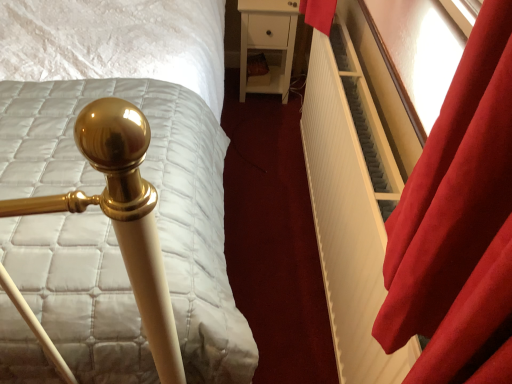
Question: From a real-world perspective, is white matte nightstand at center under velvet red curtain at right?

Choices:
 (A) no
 (B) yes

Answer: (B)

Question: Are white matte nightstand at center and velvet red curtain at right beside each other?

Choices:
 (A) yes
 (B) no

Answer: (B)

Question: Is white matte nightstand at center oriented towards velvet red curtain at right?

Choices:
 (A) no
 (B) yes

Answer: (B)

Question: Does white matte nightstand at center have a lesser height compared to velvet red curtain at right?

Choices:
 (A) no
 (B) yes

Answer: (A)

Question: From the image's perspective, is white matte nightstand at center located beneath velvet red curtain at right?

Choices:
 (A) yes
 (B) no

Answer: (B)

Question: Can you confirm if white matte nightstand at center is thinner than velvet red curtain at right?

Choices:
 (A) no
 (B) yes

Answer: (A)

Question: Is white ribbed radiator at right looking in the opposite direction of gold polished bedpost at left?

Choices:
 (A) no
 (B) yes

Answer: (A)

Question: From a real-world perspective, is white ribbed radiator at right physically above gold polished bedpost at left?

Choices:
 (A) no
 (B) yes

Answer: (A)

Question: Is white ribbed radiator at right not close to gold polished bedpost at left?

Choices:
 (A) yes
 (B) no

Answer: (B)

Question: Considering the relative sizes of white ribbed radiator at right and gold polished bedpost at left in the image provided, is white ribbed radiator at right bigger than gold polished bedpost at left?

Choices:
 (A) no
 (B) yes

Answer: (A)

Question: From a real-world perspective, is white ribbed radiator at right below gold polished bedpost at left?

Choices:
 (A) yes
 (B) no

Answer: (A)

Question: From the image's perspective, is white ribbed radiator at right below gold polished bedpost at left?

Choices:
 (A) no
 (B) yes

Answer: (B)

Question: Is white ribbed radiator at right taller than white matte nightstand at center?

Choices:
 (A) no
 (B) yes

Answer: (B)